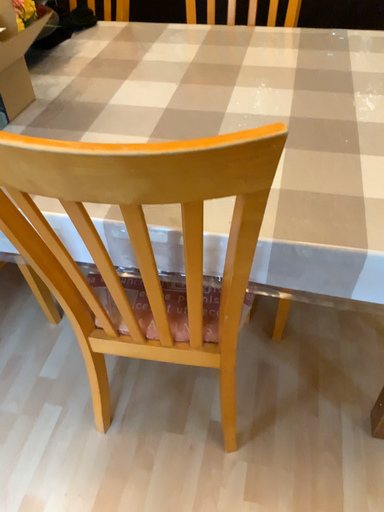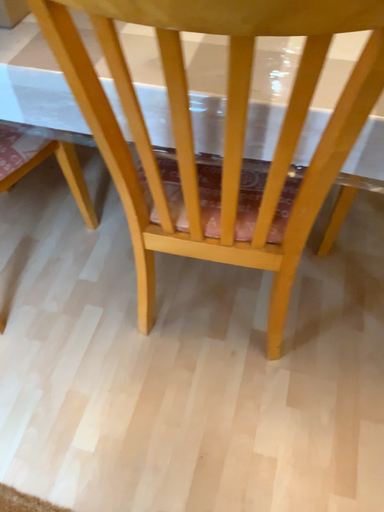
Question: How did the camera likely rotate when shooting the video?

Choices:
 (A) rotated downward
 (B) rotated upward

Answer: (A)